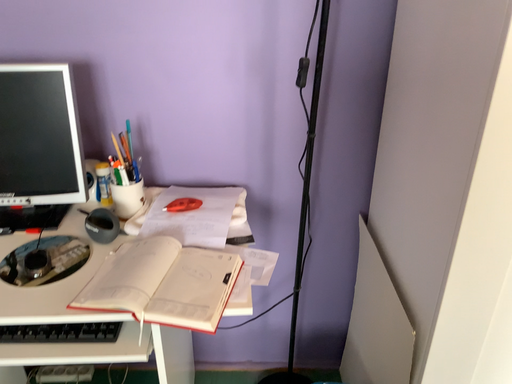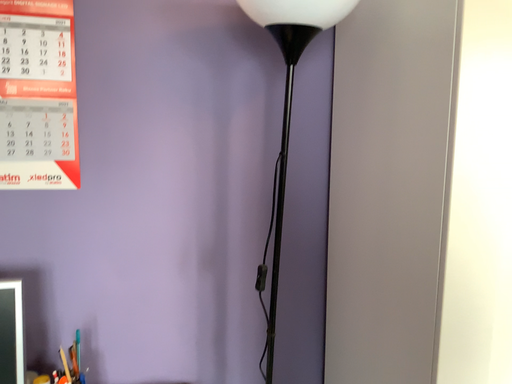
Question: Which way did the camera rotate in the video?

Choices:
 (A) rotated upward
 (B) rotated downward

Answer: (A)